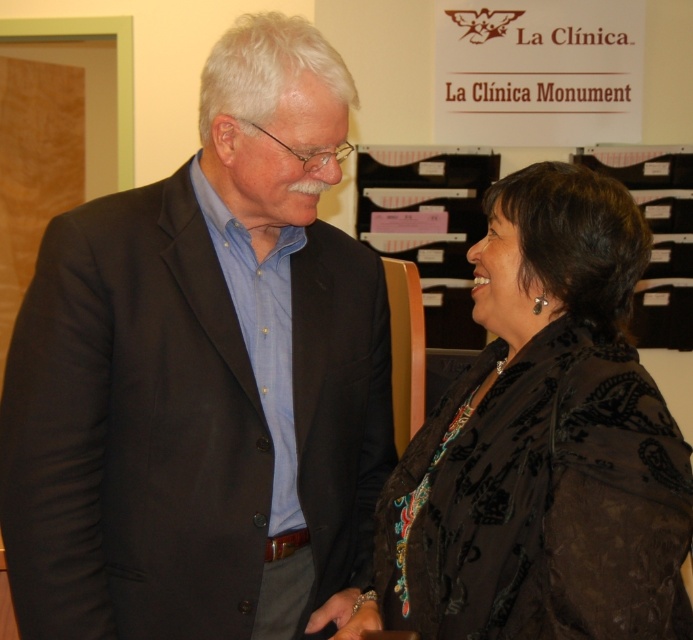
Question: Which point is farther to the camera?

Choices:
 (A) (173, 339)
 (B) (626, 348)

Answer: (B)

Question: Does matte black suit at center appear on the left side of black velvet jacket at center?

Choices:
 (A) no
 (B) yes

Answer: (B)

Question: Is matte black suit at center positioned behind black velvet jacket at center?

Choices:
 (A) no
 (B) yes

Answer: (B)

Question: Does matte black suit at center appear over black velvet jacket at center?

Choices:
 (A) no
 (B) yes

Answer: (B)

Question: Which object appears farthest from the camera in this image?

Choices:
 (A) matte black suit at center
 (B) black velvet jacket at center

Answer: (A)